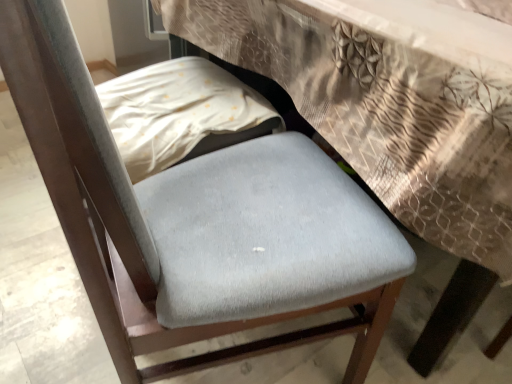
Locate an element on the screen. white fabric sheet at center is located at coordinates (381, 115).

The width and height of the screenshot is (512, 384). What do you see at coordinates (381, 115) in the screenshot? I see `white fabric sheet at center` at bounding box center [381, 115].

Find the location of a particular element. Image resolution: width=512 pixels, height=384 pixels. white fabric sheet at center is located at coordinates (381, 115).